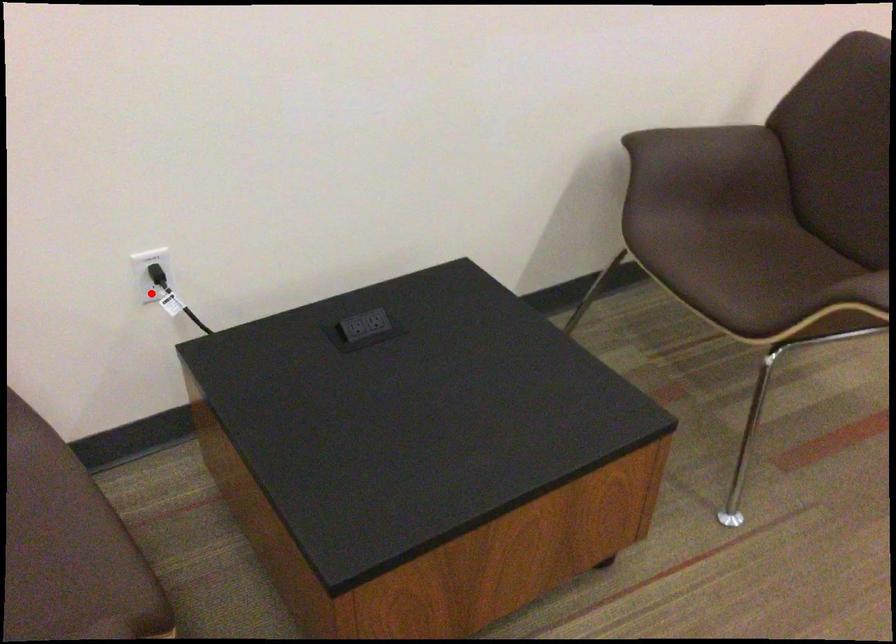
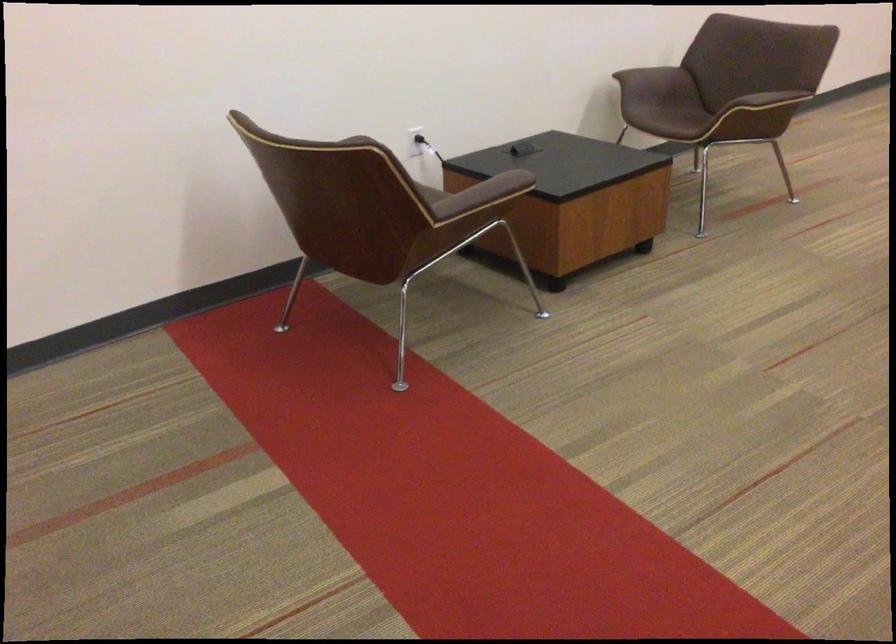
Question: A red point is marked in image1. In image2, is the corresponding 3D point closer to the camera or farther? Reply with the corresponding letter.

Choices:
 (A) The corresponding 3D point is closer.
 (B) The corresponding 3D point is farther.

Answer: (B)